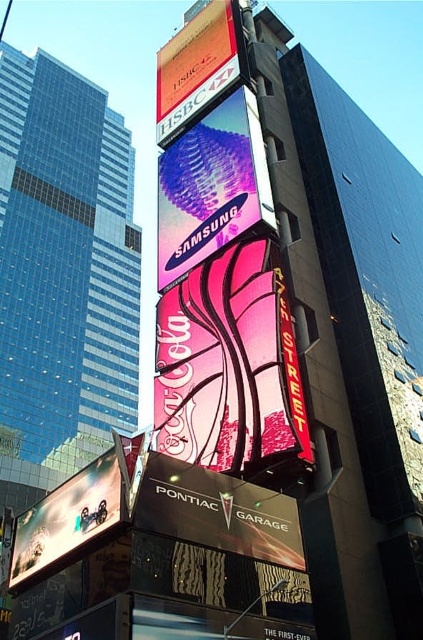
You are a city planner reviewing this urban area. You need to determine if the metallic pink samsung at center advertisement can be seen from the street level below the metallic silver billboard at lower left. Based on their positions, is this possible?

The metallic pink samsung at center is located above the metallic silver billboard at lower left, so it can be seen from the street level below the metallic silver billboard at lower left as it is positioned higher up.

You are standing in front of a large digital billboard in the city. You notice a point at coordinates (211, 186). Based on the scene, what object is this point located on?

The point at (211, 186) is located on the metallic pink Samsung advertisement at the center of the billboard.

You are a city planner assessing the visibility of the Samsung and Coca Cola ads on the billboard. Considering the height of the metallic pink samsung at center and orange glossy billboard at upper center, which one is more likely to be seen by pedestrians walking below?

The metallic pink samsung at center is taller than the orange glossy billboard at upper center, so it is more likely to be seen by pedestrians walking below.